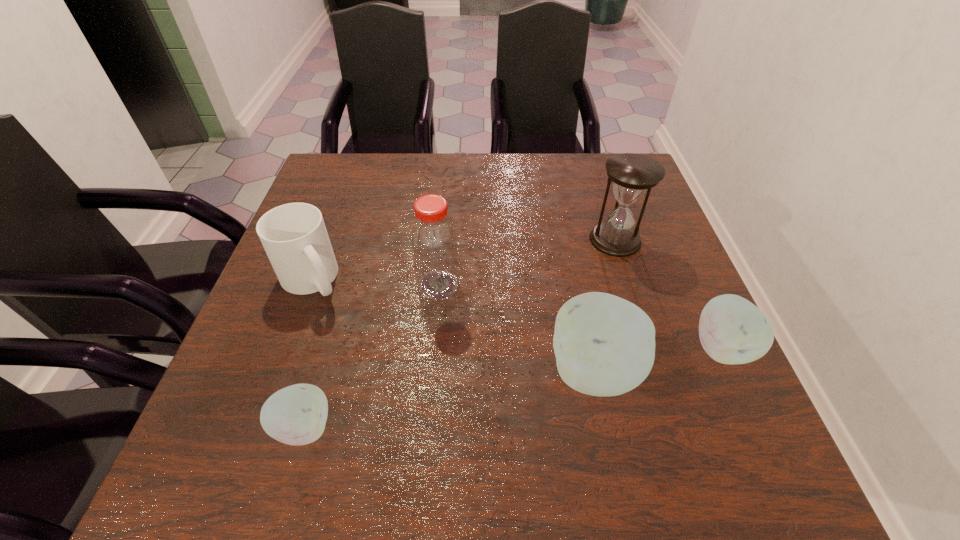
This screenshot has width=960, height=540. Find the location of `free space for an extra apple to achieve even spacing`. free space for an extra apple to achieve even spacing is located at coordinates (456, 399).